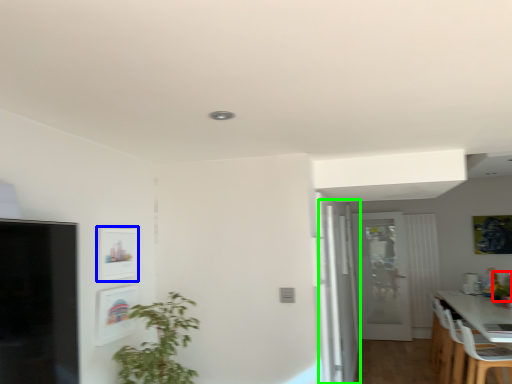
Question: Based on their relative distances, which object is nearer to plant (highlighted by a red box)? Choose from picture frame (highlighted by a blue box) and glass door (highlighted by a green box).

Choices:
 (A) picture frame
 (B) glass door

Answer: (B)